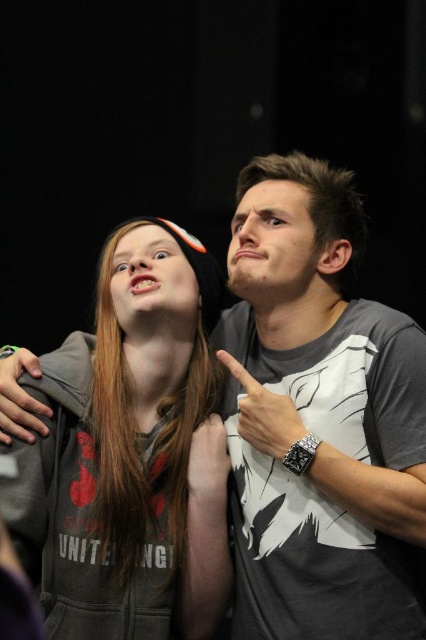
Which is above, matte gray hand at lower left or white matte hand at center?

matte gray hand at lower left is higher up.

In order to click on matte gray hand at lower left in this screenshot , I will do `click(20, 397)`.

Measure the distance between black leather watch at upper right and matte gray hand at lower left.

16.85 inches

Does black leather watch at upper right appear under matte gray hand at lower left?

Correct, black leather watch at upper right is located below matte gray hand at lower left.

Is point (264, 396) more distant than point (16, 412)?

Yes, it is.

Identify the location of black leather watch at upper right. (264, 413).

Is point (284, 396) in front of point (204, 468)?

That is True.

Is black leather watch at upper right smaller than white matte hand at center?

No, black leather watch at upper right is not smaller than white matte hand at center.

Does point (276, 442) come farther from viewer compared to point (219, 456)?

No, it is not.

This screenshot has width=426, height=640. What are the coordinates of `black leather watch at upper right` in the screenshot? It's located at (264, 413).